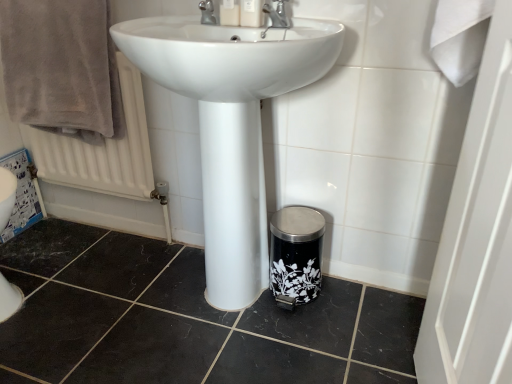
Question: Which direction should I rotate to face silver metallic tap at upper center, which ranks as the second tap in right-to-left order, — up or down?

Choices:
 (A) up
 (B) down

Answer: (A)

Question: Is matte plastic soap dispenser at upper center, positioned as the first toiletry in left-to-right order, outside silver metallic tap at upper center, which ranks as the 1th tap in left-to-right order?

Choices:
 (A) yes
 (B) no

Answer: (A)

Question: Does matte plastic soap dispenser at upper center, positioned as the first toiletry in left-to-right order, have a larger size compared to silver metallic tap at upper center, which ranks as the second tap in right-to-left order?

Choices:
 (A) yes
 (B) no

Answer: (B)

Question: From the image's perspective, is matte plastic soap dispenser at upper center, positioned as the first toiletry in left-to-right order, on silver metallic tap at upper center, which ranks as the 1th tap in left-to-right order?

Choices:
 (A) no
 (B) yes

Answer: (B)

Question: Considering the relative positions of matte plastic soap dispenser at upper center, positioned as the first toiletry in left-to-right order, and silver metallic tap at upper center, which ranks as the second tap in right-to-left order, in the image provided, is matte plastic soap dispenser at upper center, positioned as the first toiletry in left-to-right order, to the right of silver metallic tap at upper center, which ranks as the second tap in right-to-left order, from the viewer's perspective?

Choices:
 (A) no
 (B) yes

Answer: (B)

Question: Considering the relative positions of matte plastic soap dispenser at upper center, positioned as the first toiletry in left-to-right order, and silver metallic tap at upper center, which ranks as the second tap in right-to-left order, in the image provided, is matte plastic soap dispenser at upper center, positioned as the first toiletry in left-to-right order, to the left of silver metallic tap at upper center, which ranks as the second tap in right-to-left order, from the viewer's perspective?

Choices:
 (A) yes
 (B) no

Answer: (B)

Question: From a real-world perspective, is matte plastic soap dispenser at upper center, positioned as the first toiletry in left-to-right order, on top of silver metallic tap at upper center, which ranks as the 1th tap in left-to-right order?

Choices:
 (A) no
 (B) yes

Answer: (B)

Question: Is silver metallic tap at upper center, which ranks as the 1th tap in left-to-right order, outside white glossy sink at center?

Choices:
 (A) no
 (B) yes

Answer: (B)

Question: Would you consider silver metallic tap at upper center, which ranks as the 1th tap in left-to-right order, to be distant from white glossy sink at center?

Choices:
 (A) yes
 (B) no

Answer: (B)

Question: From a real-world perspective, is silver metallic tap at upper center, which ranks as the second tap in right-to-left order, below white glossy sink at center?

Choices:
 (A) no
 (B) yes

Answer: (A)

Question: Is silver metallic tap at upper center, which ranks as the 1th tap in left-to-right order, facing towards white glossy sink at center?

Choices:
 (A) yes
 (B) no

Answer: (B)

Question: From the image's perspective, is silver metallic tap at upper center, which ranks as the 1th tap in left-to-right order, beneath white glossy sink at center?

Choices:
 (A) yes
 (B) no

Answer: (B)

Question: Does silver metallic tap at upper center, which ranks as the 1th tap in left-to-right order, come in front of white glossy sink at center?

Choices:
 (A) no
 (B) yes

Answer: (A)

Question: Is white glossy sink at center closer to camera compared to white textured radiator at upper left?

Choices:
 (A) yes
 (B) no

Answer: (A)